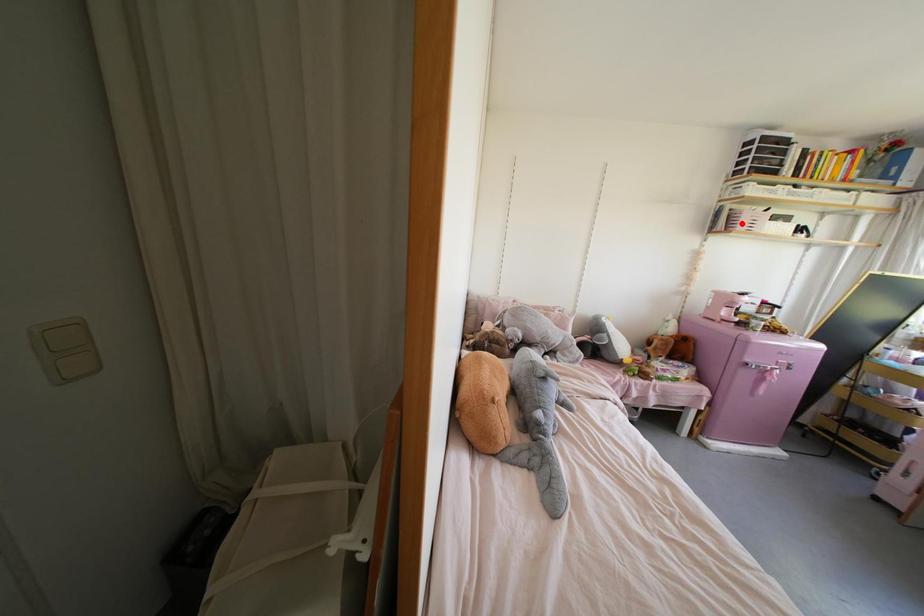
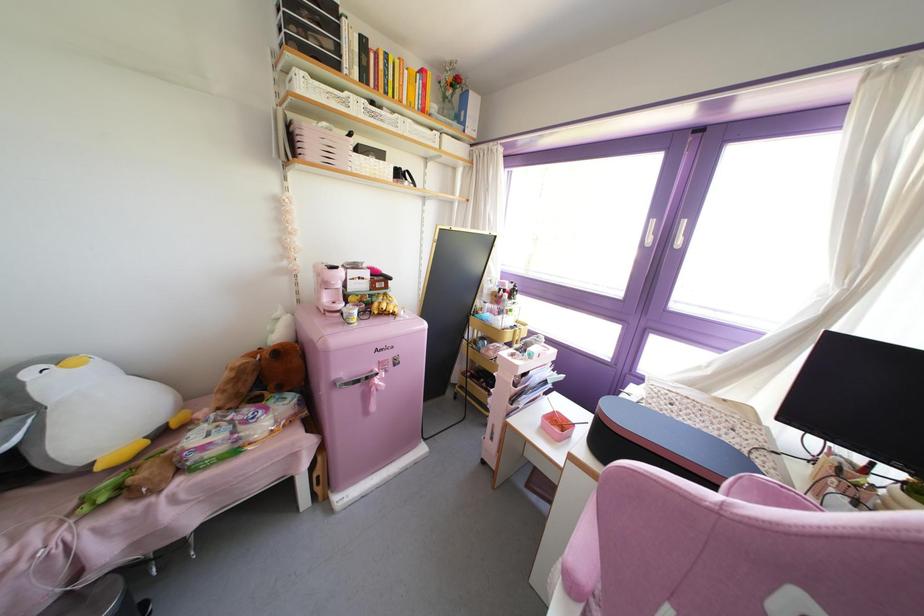
Locate, in the second image, the point that corresponds to the highlighted location in the first image.

(310, 148)